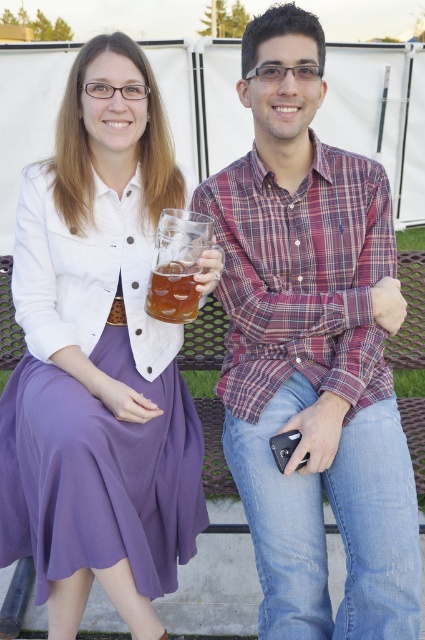
You are a photographer standing in front of the scene. You need to take a photo of the plaid shirt at center and the matte glass mug at left. Which object should you focus on first if you want to capture both in the same frame without moving the camera?

The plaid shirt at center is not as tall as the matte glass mug at left, so you should focus on the plaid shirt at center first since it is closer to the camera.

You are a photographer taking a picture of the plaid shirt at center and the translucent glass mug at center. Which object should you focus on first if you want to capture both clearly in your photo?

The plaid shirt at center is located below the translucent glass mug at center, so you should focus on the translucent glass mug at center first to ensure both are in focus.

You are taking a photo of the two people sitting on the metal bench. You want to focus on the point closer to the camera. Which point should you focus on, point (57, 440) or point (175, 294)?

Point (57, 440) is closer to the camera than point (175, 294), so you should focus on point (57, 440).